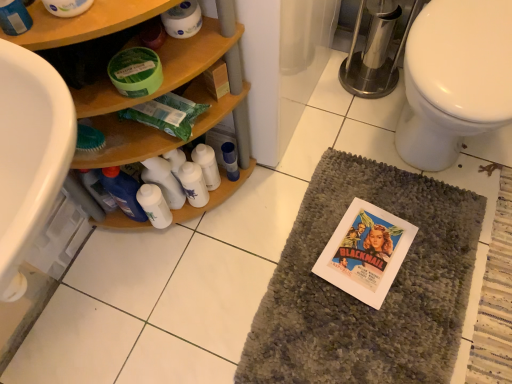
What are the coordinates of `free spot in front of white paper comic book at center` in the screenshot? It's located at (382, 332).